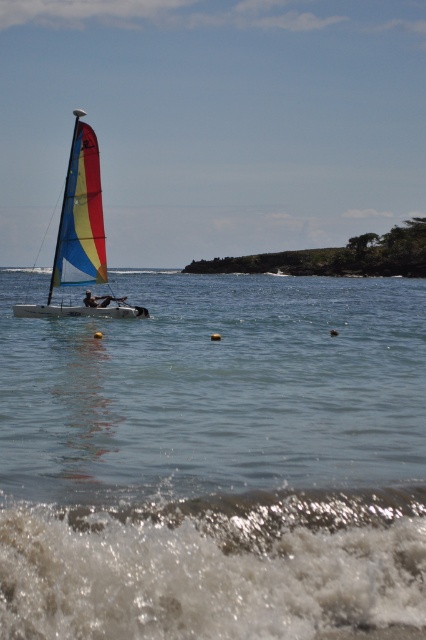
Which is behind, point (331, 532) or point (13, 570)?

The point (331, 532) is behind.

Which is above, clear water at center or white frothy wave at lower center?

Positioned higher is clear water at center.

Is point (279, 435) closer to viewer compared to point (109, 538)?

No.

I want to click on clear water at center, so click(215, 461).

Does clear water at center lie in front of matte sailboat at left?

Yes, clear water at center is closer to the viewer.

Does clear water at center appear over matte sailboat at left?

No, clear water at center is not above matte sailboat at left.

The height and width of the screenshot is (640, 426). What do you see at coordinates (215, 461) in the screenshot? I see `clear water at center` at bounding box center [215, 461].

Where is `clear water at center`? The height and width of the screenshot is (640, 426). clear water at center is located at coordinates (215, 461).

Which is above, white frothy wave at lower center or matte sailboat at left?

matte sailboat at left

Does white frothy wave at lower center have a greater height compared to matte sailboat at left?

No.

Identify the location of white frothy wave at lower center. This screenshot has width=426, height=640. (216, 566).

Find the location of a particular element. The image size is (426, 640). white frothy wave at lower center is located at coordinates (216, 566).